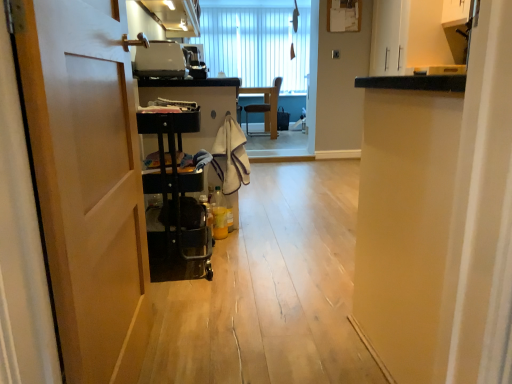
Question: Does point (242, 76) appear closer or farther from the camera than point (185, 135)?

Choices:
 (A) closer
 (B) farther

Answer: (B)

Question: Is white vertical blinds at upper center wider or thinner than black plastic cart at left?

Choices:
 (A) wide
 (B) thin

Answer: (B)

Question: Which is nearer to the black plastic cart at left?

Choices:
 (A) wooden chair at center
 (B) wooden at left
 (C) matte white cabinet at upper center
 (D) white vertical blinds at upper center
 (E) matte black toaster at upper center

Answer: (E)

Question: Which of these objects is positioned closest to the matte black toaster at upper center?

Choices:
 (A) beige textured towel at center
 (B) matte white cabinet at upper center
 (C) wooden chair at center
 (D) wooden at left
 (E) white vertical blinds at upper center

Answer: (A)